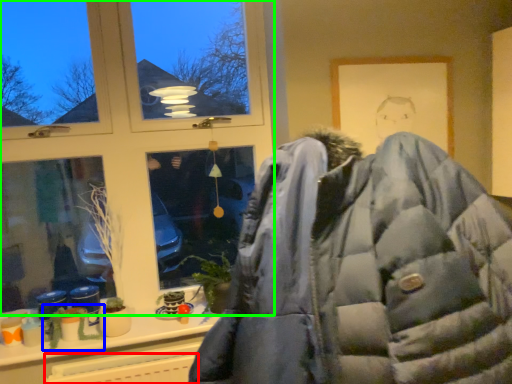
Question: Which object is positioned farthest from radiator (highlighted by a red box)? Select from plant (highlighted by a blue box) and window (highlighted by a green box).

Choices:
 (A) plant
 (B) window

Answer: (B)